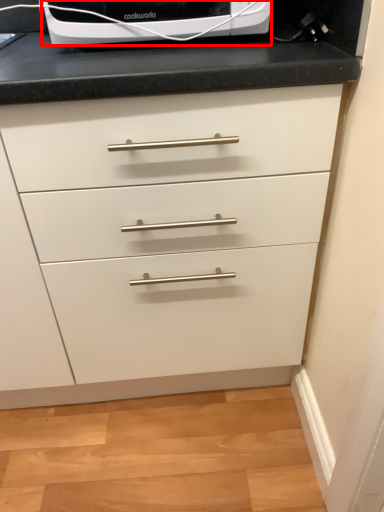
Question: From the image's perspective, what is the correct spatial relationship of home appliance (annotated by the red box) in relation to chest of drawers?

Choices:
 (A) above
 (B) below

Answer: (A)